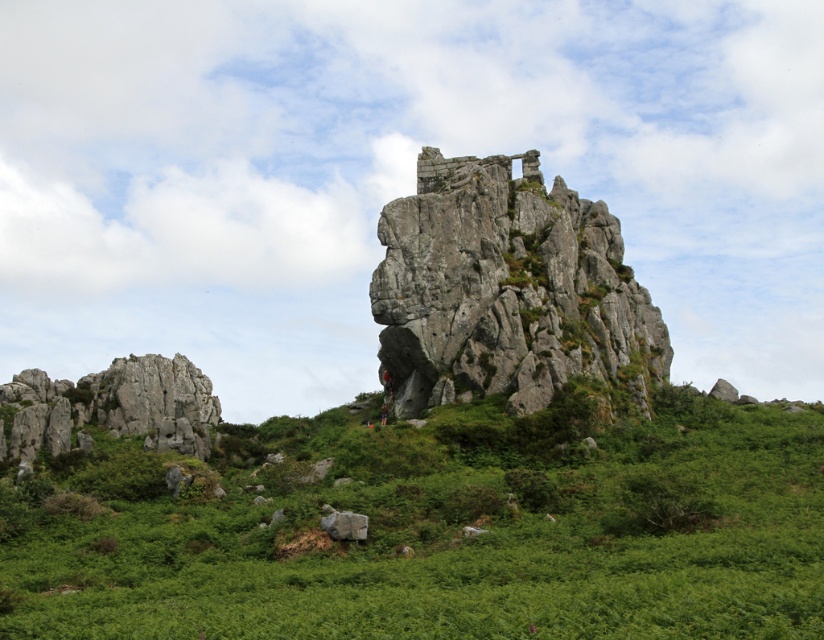
Does green grassy at lower left have a lesser height compared to gray rough rock at lower center?

Incorrect, green grassy at lower left's height does not fall short of gray rough rock at lower center's.

Is green grassy at lower left below gray rough rock at lower center?

No.

Which is in front, point (766, 464) or point (338, 531)?

Point (338, 531)

Identify the location of green grassy at lower left. (434, 529).

Which is more to the left, rugged stone mountain at center or rough stone rock at left?

From the viewer's perspective, rough stone rock at left appears more on the left side.

Is rugged stone mountain at center to the left of rough stone rock at left from the viewer's perspective?

Incorrect, rugged stone mountain at center is not on the left side of rough stone rock at left.

Measure the distance between point [553,220] and camera.

Point [553,220] is 321.93 feet from camera.

Image resolution: width=824 pixels, height=640 pixels. I want to click on rugged stone mountain at center, so click(506, 291).

Who is positioned more to the right, rough stone rock at left or gray rough rock at lower center?

gray rough rock at lower center is more to the right.

Image resolution: width=824 pixels, height=640 pixels. Describe the element at coordinates (111, 406) in the screenshot. I see `rough stone rock at left` at that location.

At what (x,y) coordinates should I click in order to perform the action: click on rough stone rock at left. Please return your answer as a coordinate pair (x, y). Looking at the image, I should click on (111, 406).